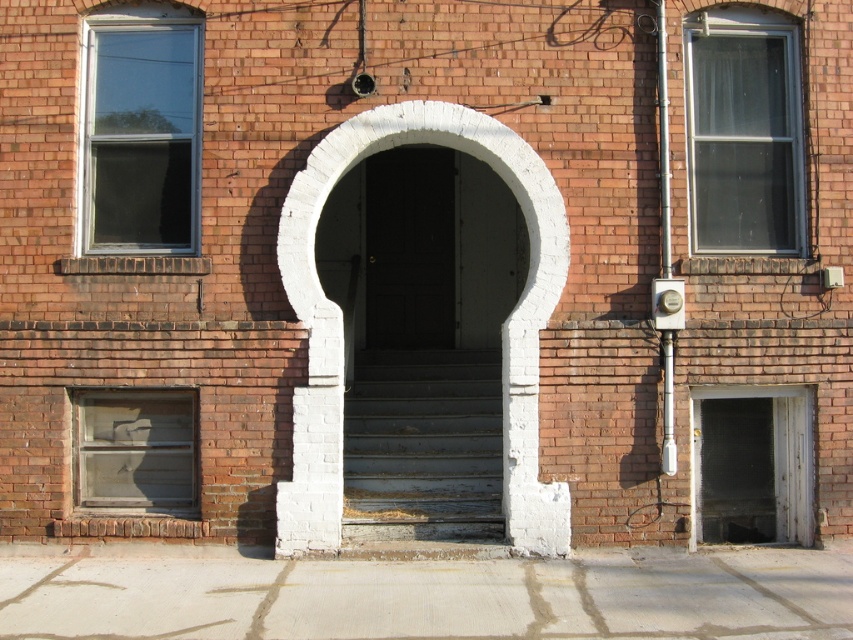
Looking at this image, you are standing at the entrance of the brick building and want to reach the door. Based on the image, where exactly are the rusty metal stairs at center located in relation to your current position?

The rusty metal stairs at center are located at point 0.698 on the x axis and 0.497 on the y axis relative to the image frame.

You are a painter trying to decide whether to paint the white plaster archway at center and the rusty metal stairs at center. Since you want to paint the taller structure first, which one should you start with?

The white plaster archway at center is much taller than the rusty metal stairs at center, so you should start painting the white plaster archway at center first.